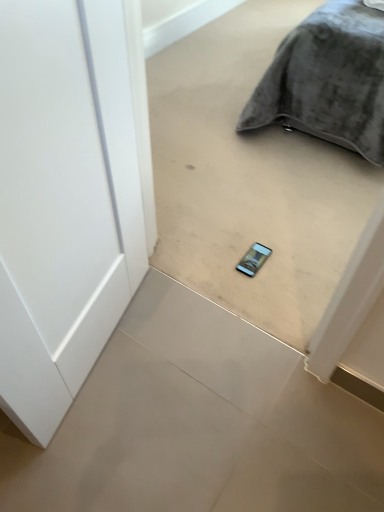
What are the coordinates of `vacant space situated on the left part of velvet gray pillow at upper right` in the screenshot? It's located at 200,99.